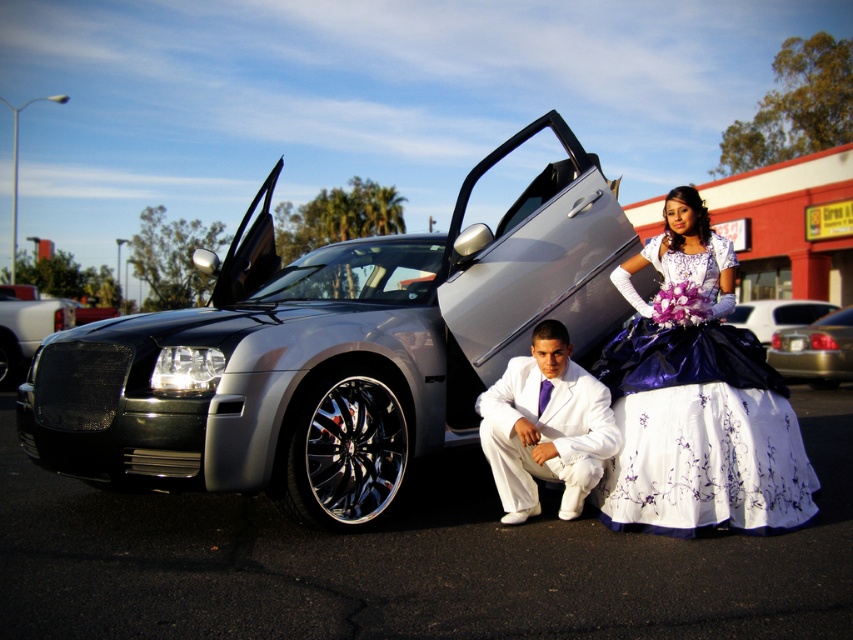
You are a photographer standing 40 feet away from the shiny chrome grille at center. You want to take a closeup photo of it. Is your current distance sufficient for a clear, detailed shot?

The shiny chrome grille at center is 39.61 feet away from the camera. Since you are standing 40 feet away, your distance is sufficient for a clear, detailed shot.

What object is located at the coordinate point (x=337, y=346) in the image?

The satin silver car at center is located at the coordinate point (x=337, y=346).